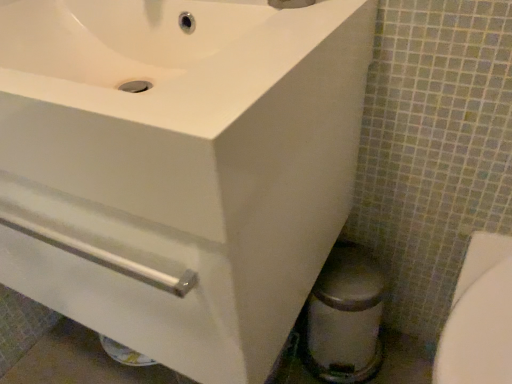
Describe the element at coordinates (290, 4) in the screenshot. I see `brushed metal faucet at upper center` at that location.

What is the approximate height of white glossy bidet at lower right?

17.14 inches.

At what (x,y) coordinates should I click in order to perform the action: click on white glossy sink at upper left. Please return your answer as a coordinate pair (x, y). Looking at the image, I should click on (179, 168).

From the picture: Which of these two, brushed metal faucet at upper center or white glossy bidet at lower right, stands taller?

Standing taller between the two is white glossy bidet at lower right.

Which is behind, point (267, 1) or point (496, 296)?

The point (496, 296) is farther.

Is brushed metal faucet at upper center far away from white glossy bidet at lower right?

Actually, brushed metal faucet at upper center and white glossy bidet at lower right are a little close together.

Considering the positions of objects brushed metal faucet at upper center and white glossy bidet at lower right in the image provided, who is more to the left, brushed metal faucet at upper center or white glossy bidet at lower right?

brushed metal faucet at upper center.

At what (x,y) coordinates should I click in order to perform the action: click on sink above the white glossy bidet at lower right (from the image's perspective). Please return your answer as a coordinate pair (x, y). The height and width of the screenshot is (384, 512). Looking at the image, I should click on (179, 168).

Which of these two, white glossy sink at upper left or white glossy bidet at lower right, stands shorter?

With less height is white glossy sink at upper left.

Is point (284, 130) closer to camera compared to point (492, 349)?

Yes, it is in front of point (492, 349).

Looking at this image, is white glossy sink at upper left with white glossy bidet at lower right?

No, white glossy sink at upper left is not with white glossy bidet at lower right.

From a real-world perspective, which is physically below, white glossy sink at upper left or brushed metal faucet at upper center?

white glossy sink at upper left is physically lower.

Between white glossy sink at upper left and brushed metal faucet at upper center, which one has smaller width?

brushed metal faucet at upper center is thinner.

Which is more to the right, white glossy sink at upper left or brushed metal faucet at upper center?

From the viewer's perspective, brushed metal faucet at upper center appears more on the right side.

Is white glossy bidet at lower right wider or thinner than brushed metal faucet at upper center?

white glossy bidet at lower right is wider than brushed metal faucet at upper center.

From their relative heights in the image, would you say white glossy bidet at lower right is taller or shorter than brushed metal faucet at upper center?

Clearly, white glossy bidet at lower right is taller compared to brushed metal faucet at upper center.

Is white glossy bidet at lower right spatially inside brushed metal faucet at upper center, or outside of it?

white glossy bidet at lower right exists outside the volume of brushed metal faucet at upper center.

Which point is more distant from viewer, (493,282) or (298,6)?

The point (493,282) is more distant.

How distant is brushed metal faucet at upper center from white glossy sink at upper left?

A distance of 35.23 centimeters exists between brushed metal faucet at upper center and white glossy sink at upper left.

From a real-world perspective, is brushed metal faucet at upper center on white glossy sink at upper left?

Yes, from a real-world perspective, brushed metal faucet at upper center is over white glossy sink at upper left

Choose the correct answer: Is brushed metal faucet at upper center inside white glossy sink at upper left or outside it?

brushed metal faucet at upper center is spatially situated outside white glossy sink at upper left.

Image resolution: width=512 pixels, height=384 pixels. I want to click on sink in front of the brushed metal faucet at upper center, so click(179, 168).

Is point (434, 359) farther from camera compared to point (3, 275)?

Yes, it is.

Between white glossy bidet at lower right and white glossy sink at upper left, which one has larger size?

white glossy sink at upper left is bigger.

Can you tell me how much white glossy bidet at lower right and white glossy sink at upper left differ in facing direction?

white glossy bidet at lower right and white glossy sink at upper left are facing 1.16 degrees away from each other.

From a real-world perspective, is white glossy bidet at lower right located higher than white glossy sink at upper left?

No.

Where is `bidet that appears on the right of brushed metal faucet at upper center`? bidet that appears on the right of brushed metal faucet at upper center is located at coordinates (479, 332).

Locate an element on the screen. The width and height of the screenshot is (512, 384). bidet below the white glossy sink at upper left (from the image's perspective) is located at coordinates (479, 332).

Based on their spatial positions, is brushed metal faucet at upper center or white glossy bidet at lower right further from white glossy sink at upper left?

Among the two, white glossy bidet at lower right is located further to white glossy sink at upper left.

Based on their spatial positions, is white glossy sink at upper left or brushed metal faucet at upper center closer to white glossy bidet at lower right?

white glossy sink at upper left is positioned closer to the anchor white glossy bidet at lower right.

When comparing their distances from white glossy bidet at lower right, does brushed metal faucet at upper center or white glossy sink at upper left seem closer?

The object closer to white glossy bidet at lower right is white glossy sink at upper left.

Looking at this image, when comparing their distances from white glossy sink at upper left, does white glossy bidet at lower right or brushed metal faucet at upper center seem closer?

Among the two, brushed metal faucet at upper center is located nearer to white glossy sink at upper left.

Estimate the real-world distances between objects in this image. Which object is further from brushed metal faucet at upper center, white glossy bidet at lower right or white glossy sink at upper left?

white glossy bidet at lower right is positioned further to the anchor brushed metal faucet at upper center.

Which object lies further to the anchor point brushed metal faucet at upper center, white glossy sink at upper left or white glossy bidet at lower right?

white glossy bidet at lower right is positioned further to the anchor brushed metal faucet at upper center.

In order to click on sink that lies between brushed metal faucet at upper center and white glossy bidet at lower right from top to bottom in this screenshot , I will do `click(179, 168)`.